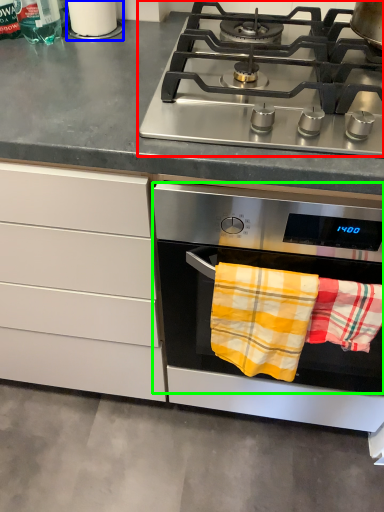
Question: Which is farther away from gas stove (highlighted by a red box)? appliance (highlighted by a blue box) or oven (highlighted by a green box)?

Choices:
 (A) appliance
 (B) oven

Answer: (A)